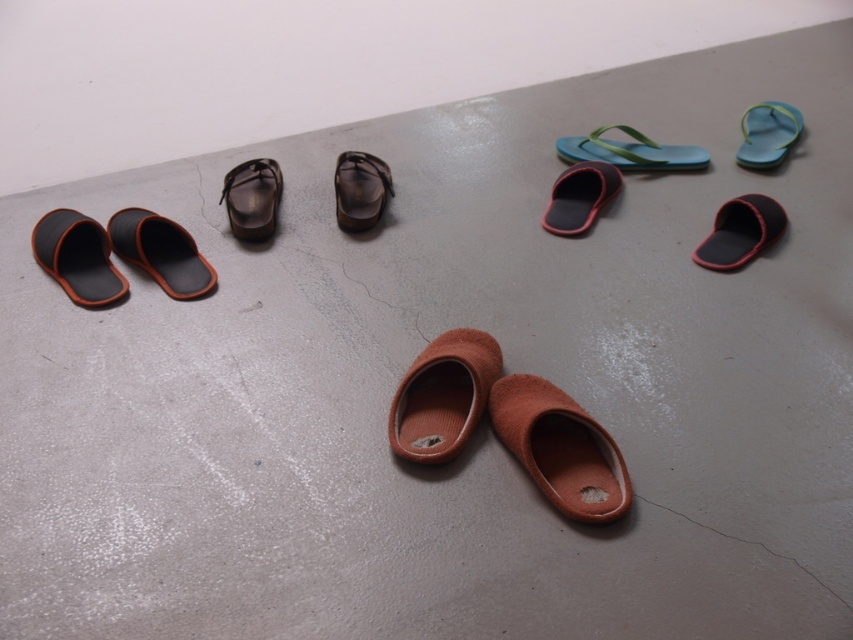
Can you confirm if matte black slipper at center is taller than leather-like brown slipper at center?

In fact, matte black slipper at center may be shorter than leather-like brown slipper at center.

Is matte black slipper at center closer to camera compared to leather-like brown slipper at center?

That is False.

Locate an element on the screen. The height and width of the screenshot is (640, 853). matte black slipper at center is located at coordinates (579, 196).

Where is `matte black slipper at center`? Image resolution: width=853 pixels, height=640 pixels. matte black slipper at center is located at coordinates (579, 196).

Which is in front, point (569, 444) or point (590, 157)?

Point (569, 444) is in front.

Which is behind, point (531, 470) or point (561, 152)?

The point (561, 152) is more distant.

Image resolution: width=853 pixels, height=640 pixels. I want to click on brown suede slipper at lower center, so click(x=560, y=449).

Is matte black slipper at left smaller than matte green flip-flop at upper right?

Yes, matte black slipper at left is smaller than matte green flip-flop at upper right.

Between matte black slipper at left and matte green flip-flop at upper right, which one has less height?

Result: matte green flip-flop at upper right is shorter.

Does point (165, 276) come closer to viewer compared to point (614, 154)?

Yes, it is in front of point (614, 154).

Where is `matte black slipper at left`? Image resolution: width=853 pixels, height=640 pixels. matte black slipper at left is located at coordinates (161, 252).